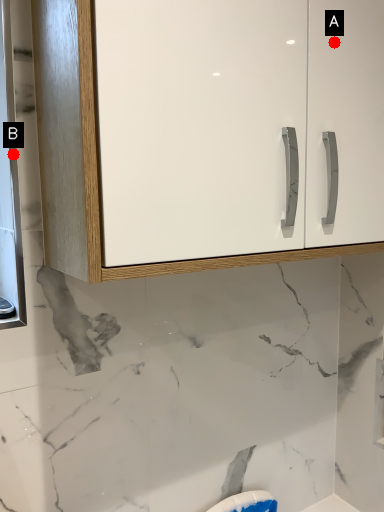
Question: Two points are circled on the image, labeled by A and B beside each circle. Among these points, which one is nearest to the camera?

Choices:
 (A) A is closer
 (B) B is closer

Answer: (B)